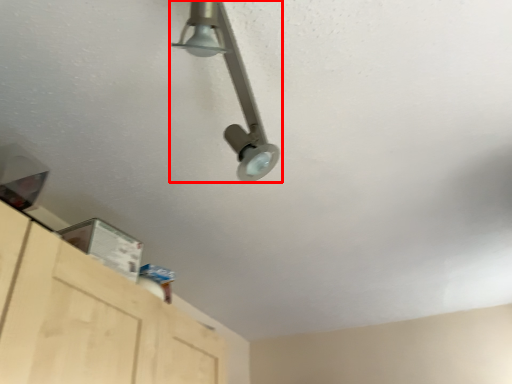
Question: From the image, what is the correct spatial relationship of lamp (annotated by the red box) in relation to cabinetry?

Choices:
 (A) left
 (B) right

Answer: (B)